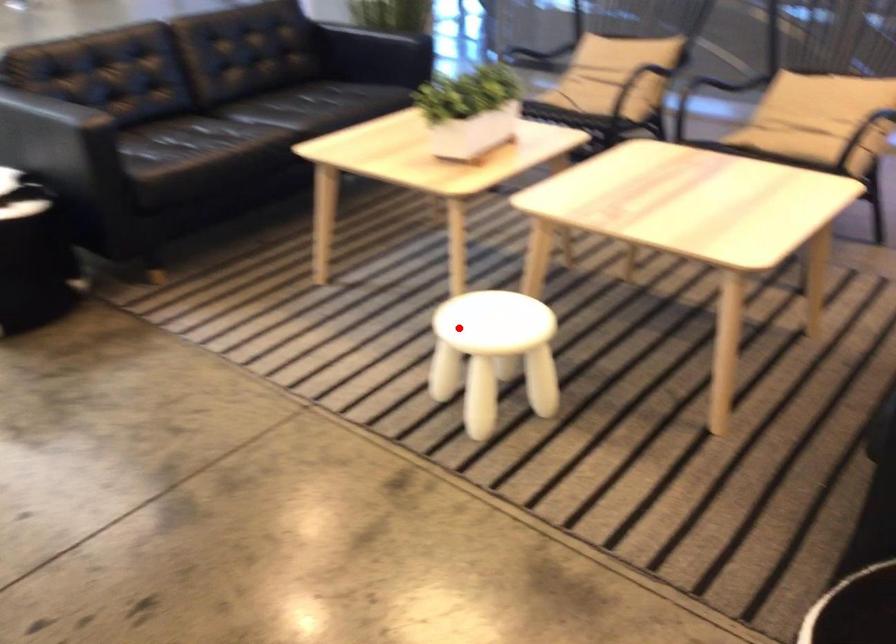
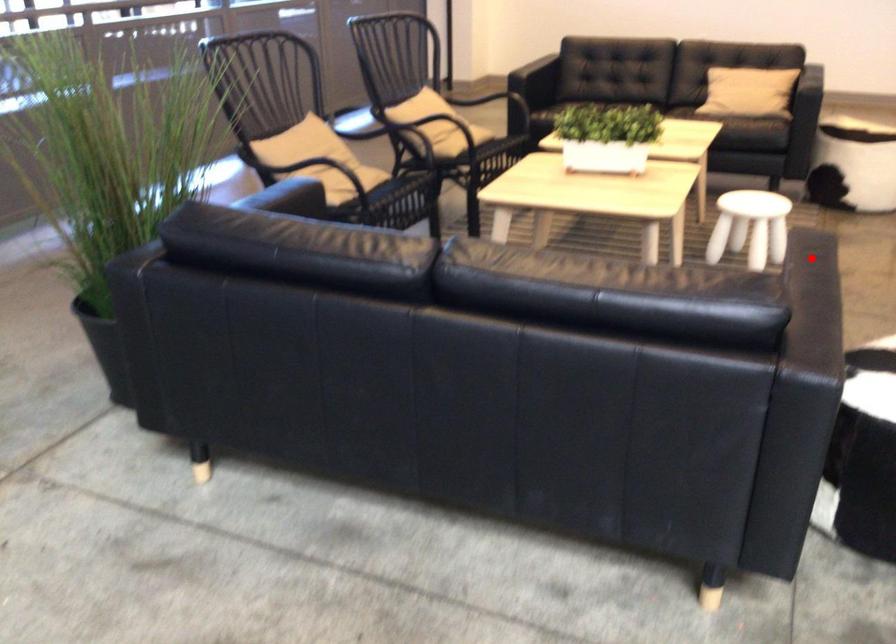
From the picture: I am providing you with two images of the same scene from different viewpoints. A red point is marked on the first image and another point is marked on the second image. Is the marked point in image1 the same physical position as the marked point in image2?

No